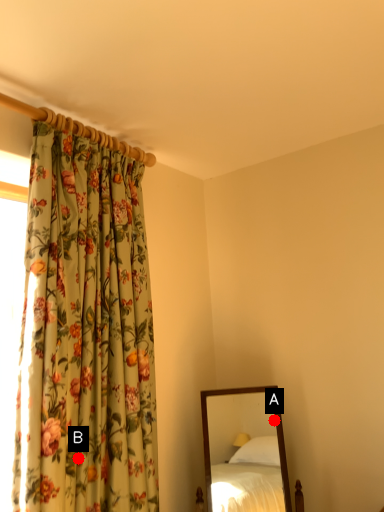
Question: Two points are circled on the image, labeled by A and B beside each circle. Which point is closer to the camera taking this photo?

Choices:
 (A) A is closer
 (B) B is closer

Answer: (B)